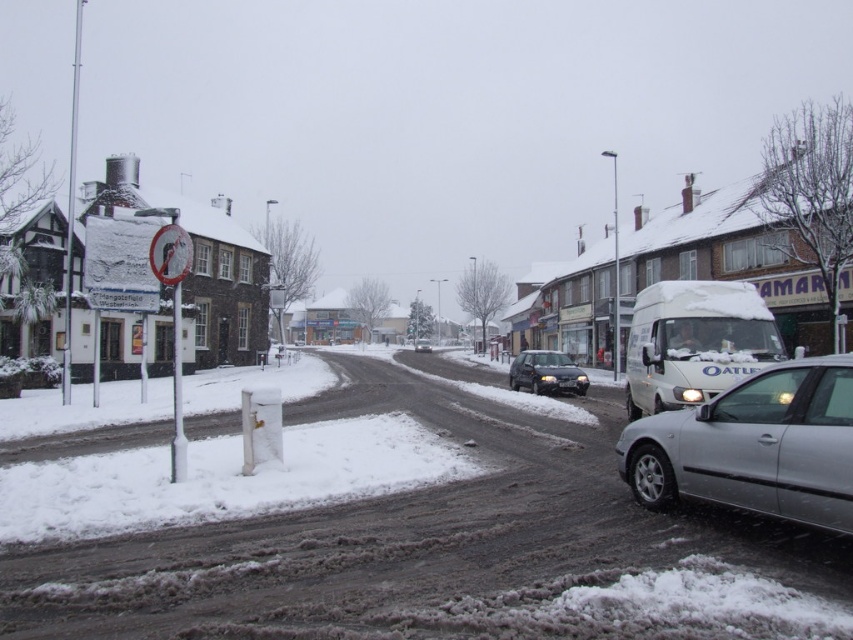
Can you confirm if silver metallic car at right is thinner than matte black car at center?

Correct, silver metallic car at right's width is less than matte black car at center's.

In the scene shown: Is silver metallic car at right wider than matte black car at center?

No, silver metallic car at right is not wider than matte black car at center.

The width and height of the screenshot is (853, 640). I want to click on silver metallic car at right, so click(x=753, y=445).

Who is lower down, silver metallic car at right or white matte van at right?

silver metallic car at right

Based on the photo, who is higher up, silver metallic car at right or white matte van at right?

white matte van at right

Measure the distance between point (850, 380) and camera.

Point (850, 380) is 6.11 meters away from camera.

Find the location of a particular element. This screenshot has width=853, height=640. silver metallic car at right is located at coordinates (753, 445).

Can you confirm if matte black car at center is positioned below silver metallic sedan at center?

Actually, matte black car at center is above silver metallic sedan at center.

Does point (537, 365) lie behind point (416, 339)?

No, (537, 365) is closer to viewer.

What do you see at coordinates (546, 372) in the screenshot? I see `matte black car at center` at bounding box center [546, 372].

Where is `matte black car at center`? matte black car at center is located at coordinates (546, 372).